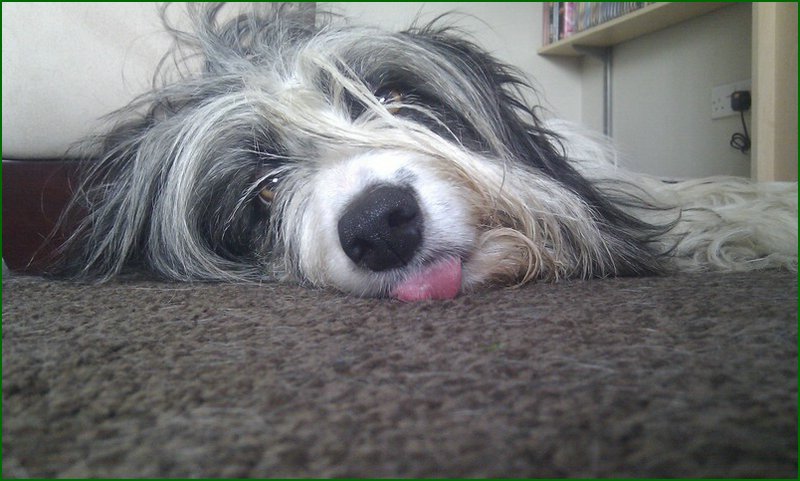
Locate an element on the screen. The height and width of the screenshot is (481, 800). wall is located at coordinates (113, 34).